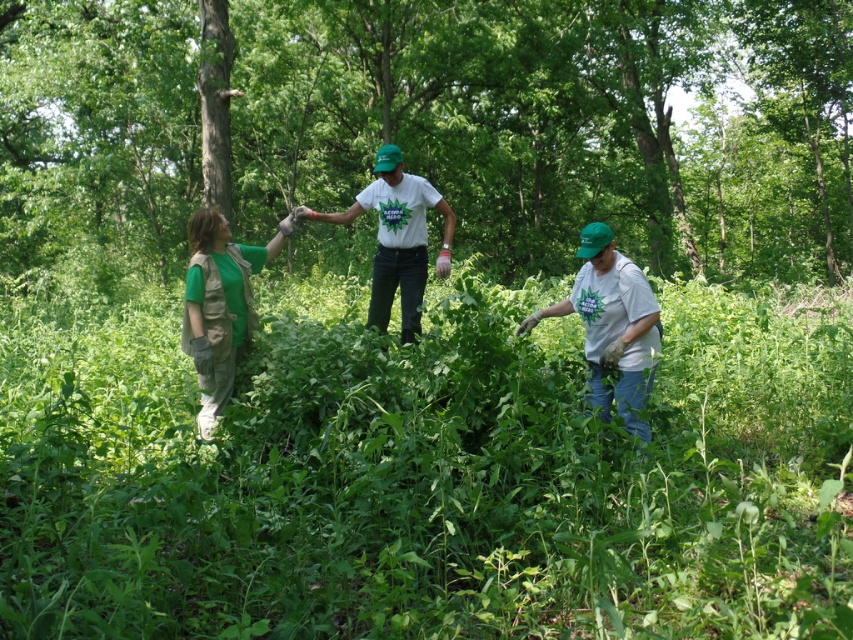
Who is positioned more to the left, white matte shirt at lower right or green matte vest at left?

green matte vest at left

Is white matte shirt at lower right below green matte vest at left?

Correct, white matte shirt at lower right is located below green matte vest at left.

Which is behind, point (560, 305) or point (256, 257)?

The point (256, 257) is behind.

At what (x,y) coordinates should I click in order to perform the action: click on white matte shirt at lower right. Please return your answer as a coordinate pair (x, y). The width and height of the screenshot is (853, 640). Looking at the image, I should click on (612, 324).

Between white matte shirt at lower right and white matte t-shirt at center, which one is positioned lower?

white matte shirt at lower right is lower down.

Which is above, white matte shirt at lower right or white matte t-shirt at center?

white matte t-shirt at center is above.

The width and height of the screenshot is (853, 640). What do you see at coordinates (612, 324) in the screenshot?
I see `white matte shirt at lower right` at bounding box center [612, 324].

You are a GUI agent. You are given a task and a screenshot of the screen. Output one action in this format:
    pyautogui.click(x=<x>, y=<y>)
    Task: Click on the white matte shirt at lower right
    The height and width of the screenshot is (640, 853).
    Given the screenshot: What is the action you would take?
    pyautogui.click(x=612, y=324)

Between green leafy tree at center and green matte vest at left, which one has less height?

green matte vest at left is shorter.

Is point (50, 93) in front of point (241, 252)?

No, it is behind (241, 252).

The height and width of the screenshot is (640, 853). I want to click on green leafy tree at center, so click(561, 122).